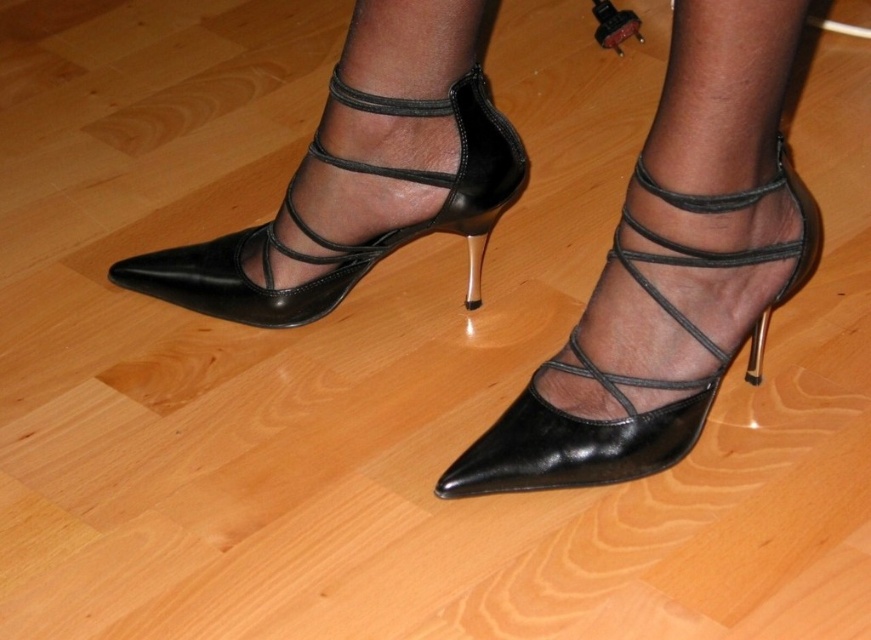
Does point (619, 225) lie in front of point (188, 276)?

Yes, it is in front of point (188, 276).

Between black leather sandal at center and black leather sandal at left, which one is positioned higher?

black leather sandal at left is above.

Between point (622, 378) and point (437, 225), which one is positioned behind?

The point (437, 225) is more distant.

You are a GUI agent. You are given a task and a screenshot of the screen. Output one action in this format:
    pyautogui.click(x=<x>, y=<y>)
    Task: Click on the black leather sandal at center
    The height and width of the screenshot is (640, 871).
    Given the screenshot: What is the action you would take?
    pyautogui.click(x=630, y=376)

Is point (354, 26) positioned behind point (481, 301)?

That is False.

Is black leather high heels at center positioned behind black leather heel at center?

That is False.

I want to click on black leather high heels at center, so click(670, 268).

Who is more forward, (280, 236) or (471, 106)?

Positioned in front is point (471, 106).

Who is higher up, black leather high heels at center or black leather sandal at left?

black leather sandal at left is higher up.

Who is more forward, (x=667, y=186) or (x=152, y=259)?

Point (x=667, y=186)

The image size is (871, 640). In order to click on black leather high heels at center in this screenshot , I will do `click(670, 268)`.